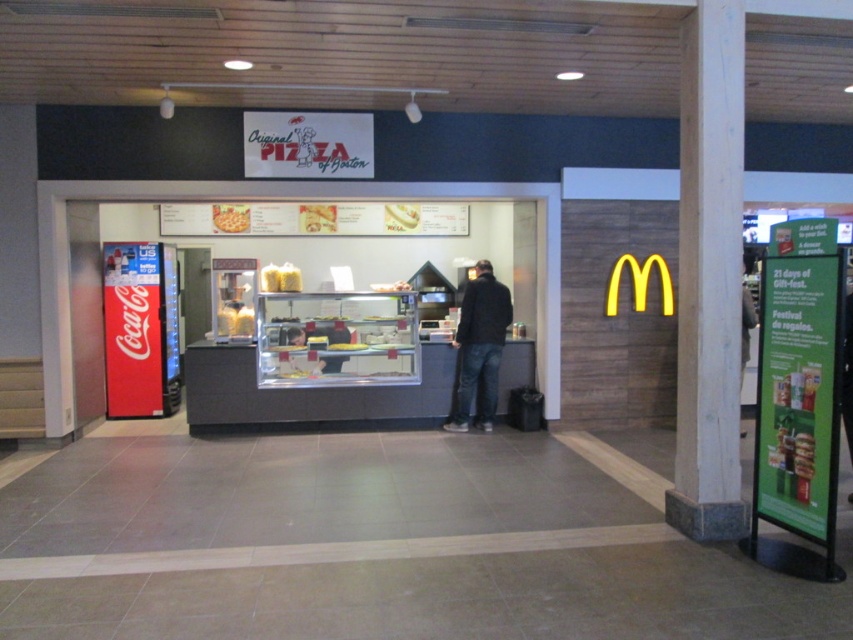
Question: Does dark blue jeans at center have a lesser width compared to matte yellow cheese at center?

Choices:
 (A) yes
 (B) no

Answer: (B)

Question: Based on their relative distances, which object is nearer to the matte yellow cheese at center?

Choices:
 (A) dark blue jeans at center
 (B) golden crispy pizza at center

Answer: (B)

Question: Does white wood pillar at center right have a smaller size compared to matte yellow cheese at center?

Choices:
 (A) no
 (B) yes

Answer: (A)

Question: Which object is farther from the camera taking this photo?

Choices:
 (A) golden crispy pizza at center
 (B) white wood pillar at center right
 (C) white glossy bread at center

Answer: (C)

Question: Estimate the real-world distances between objects in this image. Which object is farther from the dark blue jeans at center?

Choices:
 (A) white wood pillar at center right
 (B) white glossy bread at center
 (C) white plastic bread at center
 (D) golden crispy pizza at center

Answer: (D)

Question: From the image, what is the correct spatial relationship of white plastic bread at center in relation to white glossy bread at center?

Choices:
 (A) right
 (B) left

Answer: (B)